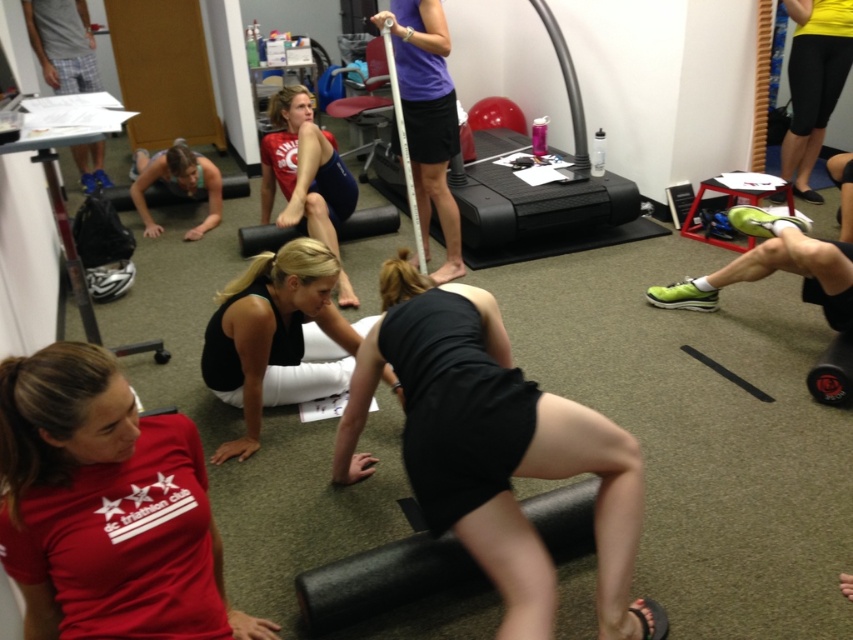
You are a fitness instructor in the gym. You need to locate the participant wearing the red matte shirt at center. Where exactly is this participant located in the room?

The participant wearing the red matte shirt at center is located at point [106,508] in the room.

You are a participant in the fitness class and need to locate your belongings. You have a red matte shirt at center and a matte red tank top at center. Which one is positioned lower?

The red matte shirt at center is located below matte red tank top at center, so the red matte shirt at center is positioned lower.

You are a photographer setting up for a group photo in the gym. You need to ensure all participants are visible. Given that the matte red tank top at center and the blue plaid shorts at upper left are two of the key elements, which one might require more strategic positioning to avoid being overshadowed?

The blue plaid shorts at upper left might require more strategic positioning since it is smaller than the matte red tank top at center, which could potentially overshadow it if not placed thoughtfully.